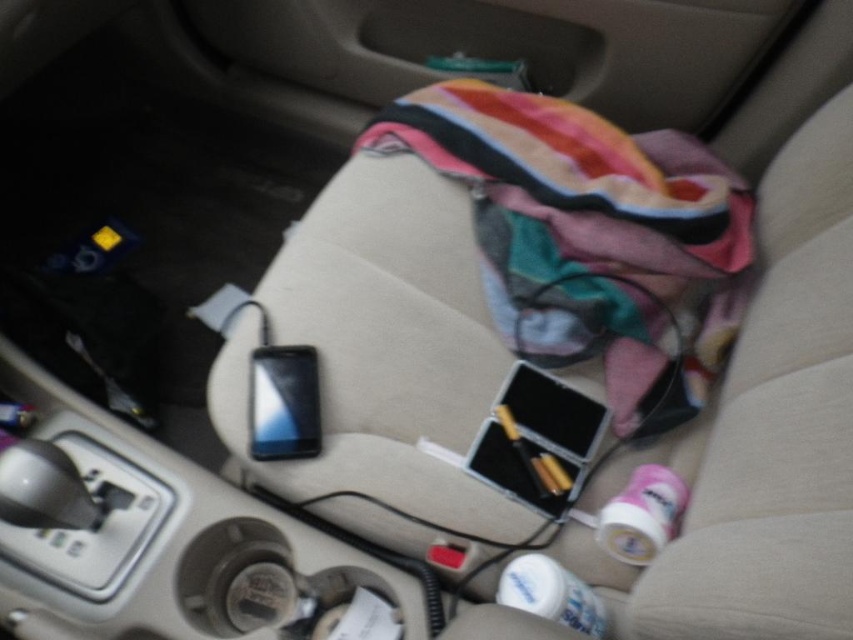
You are a passenger in the car and want to place your phone in the open black case next to the satin black phone at center. However, there is a striped cotton blanket at center in the way. Which object should you move to access the case?

You should move the striped cotton blanket at center because it is positioned on the right side of the satin black phone at center, which is blocking access to the open black case next to it.

You are a passenger in a car and need to place your phone on the passenger seat. The car has a striped cotton blanket at center and a satin black phone at center. Where should you place your phone so it doesn not get tangled with the blanket?

The striped cotton blanket at center is above the satin black phone at center, so placing the phone below the blanket would prevent tangling.

Consider the image. You are sitting in the driver seat of the car and want to reach the object at point (589, 259). Is it behind or in front of the object at point (273, 384)?

The point (589, 259) is behind point (273, 384).